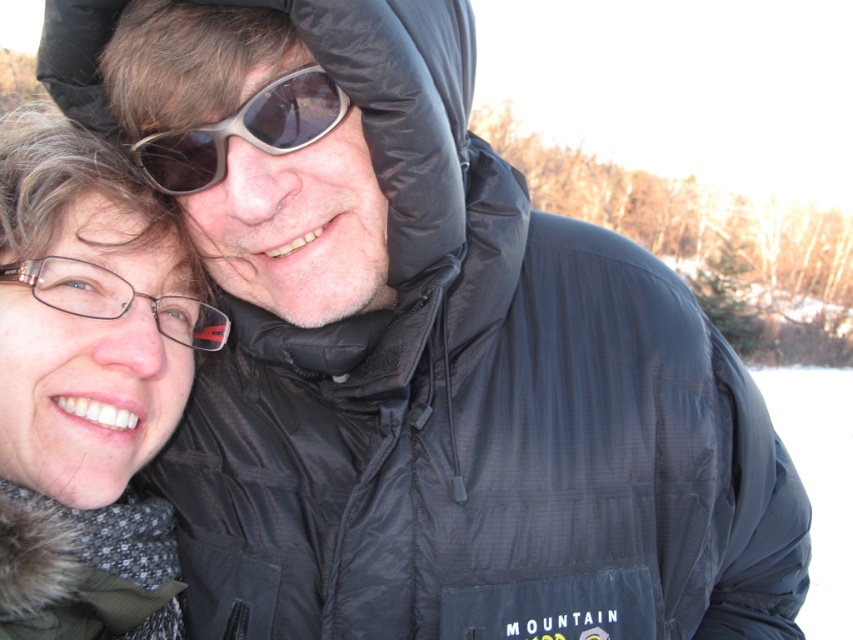
Question: Which of the following is the farthest from the observer?

Choices:
 (A) matte black glasses at upper left
 (B) sunglasses at center

Answer: (B)

Question: Can you confirm if matte black glasses at upper left is bigger than sunglasses at center?

Choices:
 (A) yes
 (B) no

Answer: (A)

Question: Does matte black glasses at upper left have a smaller size compared to sunglasses at center?

Choices:
 (A) yes
 (B) no

Answer: (B)

Question: Which of the following is the farthest from the observer?

Choices:
 (A) (166, 276)
 (B) (308, 64)

Answer: (A)

Question: Observing the image, what is the correct spatial positioning of matte black glasses at upper left in reference to sunglasses at center?

Choices:
 (A) left
 (B) right

Answer: (A)